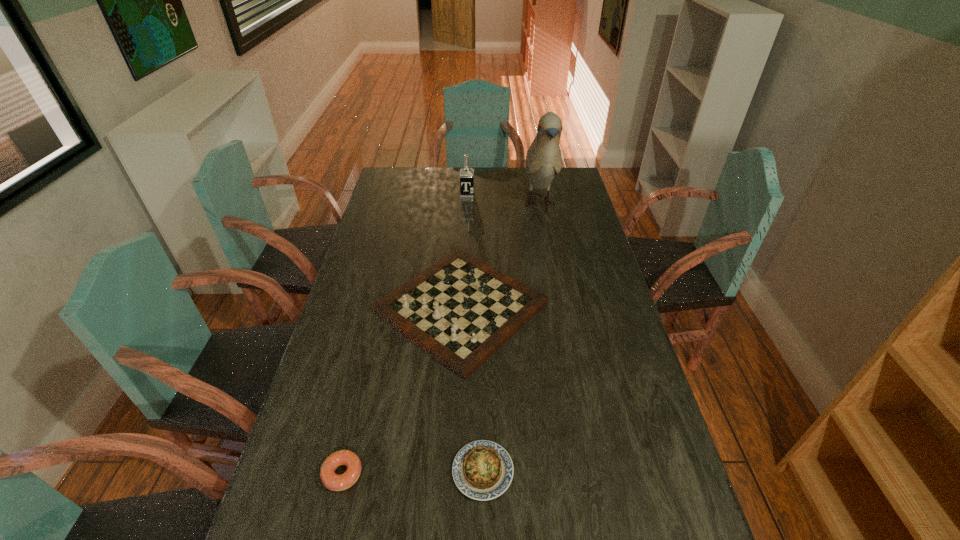
Locate an element on the screen. free space located 0.280m on the back of the shortest object is located at coordinates (482, 353).

I want to click on parakeet that is at the far edge, so click(543, 160).

Image resolution: width=960 pixels, height=540 pixels. Find the location of `vodka located in the far edge section of the desktop`. vodka located in the far edge section of the desktop is located at coordinates (466, 174).

Locate an element on the screen. The image size is (960, 540). chessboard positioned at the left edge is located at coordinates (460, 310).

At what (x,y) coordinates should I click in order to perform the action: click on doughnut that is at the left edge. Please return your answer as a coordinate pair (x, y). The width and height of the screenshot is (960, 540). Looking at the image, I should click on (331, 480).

What are the coordinates of `object that is at the right edge` in the screenshot? It's located at (543, 160).

Locate an element on the screen. The image size is (960, 540). object that is at the far right corner is located at coordinates (543, 160).

Find the location of `free spot at the far edge of the desktop`. free spot at the far edge of the desktop is located at coordinates pos(424,188).

This screenshot has height=540, width=960. What are the coordinates of `free space at the left edge` in the screenshot? It's located at (382, 220).

Find the location of `vacant position at the right edge of the desktop`. vacant position at the right edge of the desktop is located at coordinates (578, 200).